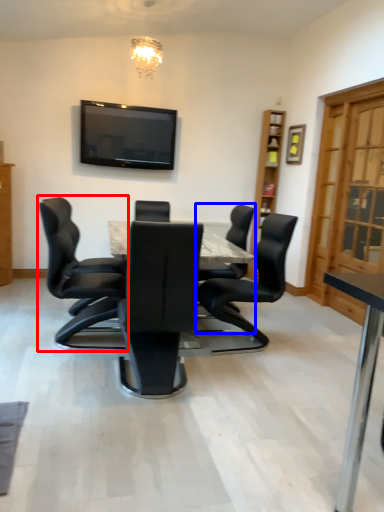
Question: Which point is closer to the camera, chair (highlighted by a red box) or chair (highlighted by a blue box)?

Choices:
 (A) chair
 (B) chair

Answer: (A)